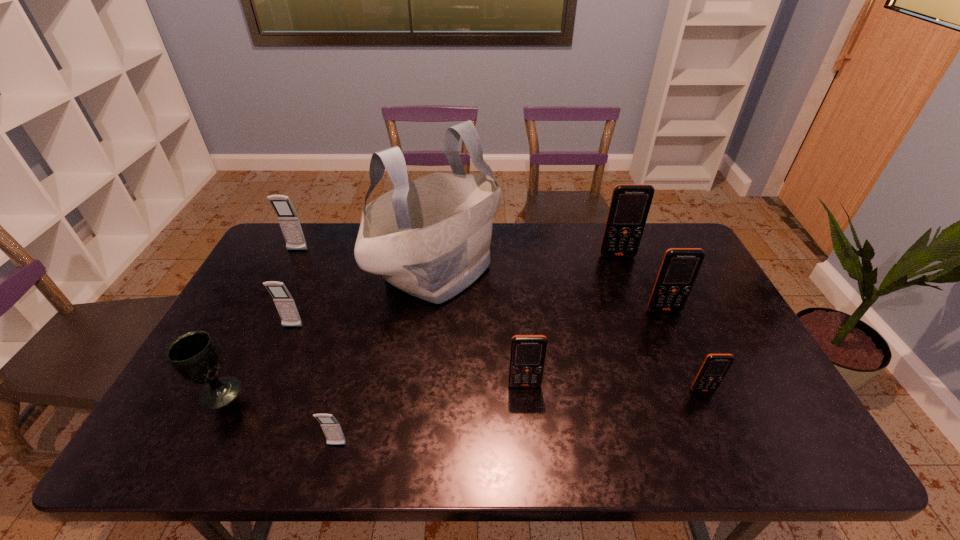
Locate an element on the screen. vacant space located 0.050m on the screen of the sixth object from left to right is located at coordinates point(527,407).

Locate an element on the screen. The image size is (960, 540). free location located on the right of the chalice is located at coordinates (343, 392).

Locate an element on the screen. free space located on the screen of the smallest orange cellular telephone is located at coordinates point(731,451).

At what (x,y) coordinates should I click in order to perform the action: click on shopping bag at the far edge. Please return your answer as a coordinate pair (x, y). Image resolution: width=960 pixels, height=540 pixels. Looking at the image, I should click on (430, 238).

Where is `object at the near edge`? This screenshot has width=960, height=540. object at the near edge is located at coordinates (331, 427).

The image size is (960, 540). In order to click on cellular telephone that is positioned at the left edge in this screenshot , I will do `click(287, 217)`.

This screenshot has height=540, width=960. What are the coordinates of `chalice situated at the left edge` in the screenshot? It's located at (194, 355).

At what (x,y) coordinates should I click in order to perform the action: click on object located at the far left corner. Please return your answer as a coordinate pair (x, y). Looking at the image, I should click on (287, 217).

In the image, there is a desktop. In order to click on vacant space at the far edge in this screenshot , I will do `click(339, 232)`.

At what (x,y) coordinates should I click in order to perform the action: click on free location at the near edge. Please return your answer as a coordinate pair (x, y). Image resolution: width=960 pixels, height=540 pixels. Looking at the image, I should click on (539, 442).